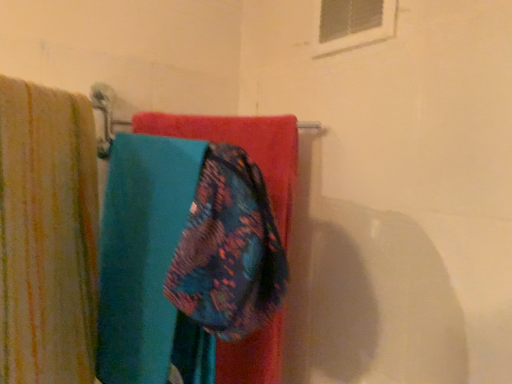
Question: Does teal fabric towel at center come in front of floral fabric towel at center?

Choices:
 (A) no
 (B) yes

Answer: (A)

Question: Considering the relative sizes of teal fabric towel at center and floral fabric towel at center in the image provided, is teal fabric towel at center shorter than floral fabric towel at center?

Choices:
 (A) yes
 (B) no

Answer: (B)

Question: Considering the relative sizes of teal fabric towel at center and floral fabric towel at center in the image provided, is teal fabric towel at center smaller than floral fabric towel at center?

Choices:
 (A) no
 (B) yes

Answer: (A)

Question: Does teal fabric towel at center have a lesser width compared to floral fabric towel at center?

Choices:
 (A) no
 (B) yes

Answer: (A)

Question: Is teal fabric towel at center positioned with its back to floral fabric towel at center?

Choices:
 (A) yes
 (B) no

Answer: (B)

Question: Can you confirm if teal fabric towel at center is positioned to the left of floral fabric towel at center?

Choices:
 (A) no
 (B) yes

Answer: (B)

Question: Can you confirm if white plastic window at upper center is thinner than teal fabric towel at center?

Choices:
 (A) yes
 (B) no

Answer: (A)

Question: Can you confirm if white plastic window at upper center is smaller than teal fabric towel at center?

Choices:
 (A) no
 (B) yes

Answer: (B)

Question: Is white plastic window at upper center not near teal fabric towel at center?

Choices:
 (A) yes
 (B) no

Answer: (B)

Question: Is white plastic window at upper center facing away from teal fabric towel at center?

Choices:
 (A) no
 (B) yes

Answer: (A)

Question: From a real-world perspective, is white plastic window at upper center positioned under teal fabric towel at center based on gravity?

Choices:
 (A) yes
 (B) no

Answer: (B)

Question: From the image's perspective, is white plastic window at upper center on teal fabric towel at center?

Choices:
 (A) yes
 (B) no

Answer: (A)

Question: Does white plastic window at upper center have a smaller size compared to striped cotton towel at left?

Choices:
 (A) yes
 (B) no

Answer: (A)